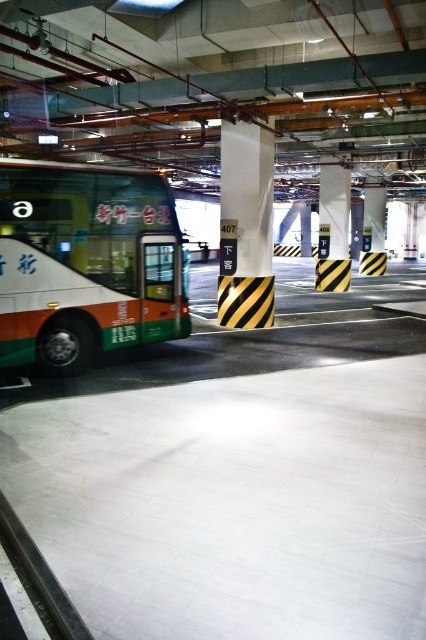
You are driving a car and want to park in the parking garage. You see the white glossy bus at left and the black striped pillar at center. Which object is closer to you as you enter the garage?

The white glossy bus at left is closer to you because it is in front of the black striped pillar at center.

You are driving a car that is 12 feet long. You want to park your car between the white glossy bus at left and the black striped pillar at center. Is there enough space for your car to fit between them?

The white glossy bus at left is 13.20 feet from the black striped pillar at center. Since your car is 12 feet long, there is enough space for your car to fit between them as the distance between the two objects is greater than the car length.